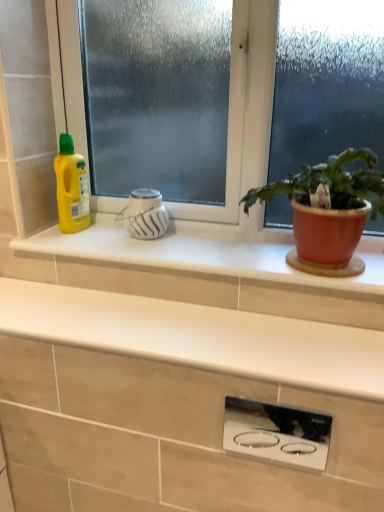
Image resolution: width=384 pixels, height=512 pixels. What do you see at coordinates (179, 400) in the screenshot? I see `white matte countertop at center` at bounding box center [179, 400].

Describe the element at coordinates (71, 187) in the screenshot. This screenshot has height=512, width=384. I see `yellow plastic bottle at left` at that location.

You are a GUI agent. You are given a task and a screenshot of the screen. Output one action in this format:
    pyautogui.click(x=<x>, y=<y>)
    Task: Click on the white glossy vase at center, which ranks as the 2th appliance in bottom-to-top order
    Image resolution: width=384 pixels, height=512 pixels.
    Given the screenshot: What is the action you would take?
    pyautogui.click(x=145, y=214)

Which object is thinner, frosted glass window at center or white matte countertop at center?

frosted glass window at center is thinner.

Is the surface of frosted glass window at center in direct contact with white matte countertop at center?

There is a gap between frosted glass window at center and white matte countertop at center.

Is frosted glass window at center looking in the opposite direction of white matte countertop at center?

No, frosted glass window at center is not facing the opposite direction of white matte countertop at center.

What's the angular difference between frosted glass window at center and white matte countertop at center's facing directions?

The angular difference between frosted glass window at center and white matte countertop at center is 0.252 degrees.

Is white glossy vase at center, which ranks as the 1th appliance in left-to-right order, looking in the opposite direction of polished stainless steel cooktop at center, positioned as the second appliance in left-to-right order?

No.

Between white glossy vase at center, positioned as the second appliance in front-to-back order, and polished stainless steel cooktop at center, acting as the 1th appliance starting from the front, which one appears on the right side from the viewer's perspective?

polished stainless steel cooktop at center, acting as the 1th appliance starting from the front.

Between white glossy vase at center, the first appliance positioned from the back, and polished stainless steel cooktop at center, the 2th appliance when ordered from top to bottom, which one has more height?

polished stainless steel cooktop at center, the 2th appliance when ordered from top to bottom, is taller.

Is polished stainless steel cooktop at center, arranged as the second appliance when viewed from the back, inside white glossy vase at center, the 2th appliance positioned from the right?

Definitely not — polished stainless steel cooktop at center, arranged as the second appliance when viewed from the back, is not inside white glossy vase at center, the 2th appliance positioned from the right.

The width and height of the screenshot is (384, 512). Find the location of `cleaning product above the polished stainless steel cooktop at center, which is the 1th appliance from bottom to top (from a real-world perspective)`. cleaning product above the polished stainless steel cooktop at center, which is the 1th appliance from bottom to top (from a real-world perspective) is located at coordinates [x=71, y=187].

From the image's perspective, which one is positioned lower, yellow plastic bottle at left or polished stainless steel cooktop at center, arranged as the second appliance when viewed from the back?

polished stainless steel cooktop at center, arranged as the second appliance when viewed from the back, from the image's perspective.

Does yellow plastic bottle at left have a larger size compared to polished stainless steel cooktop at center, which is the 1th appliance in right-to-left order?

Correct, yellow plastic bottle at left is larger in size than polished stainless steel cooktop at center, which is the 1th appliance in right-to-left order.

Which is more to the left, yellow plastic bottle at left or polished stainless steel cooktop at center, acting as the 1th appliance starting from the front?

From the viewer's perspective, yellow plastic bottle at left appears more on the left side.

Between white glossy window sill at center and frosted glass window at center, which one has more height?

Standing taller between the two is frosted glass window at center.

Are white glossy window sill at center and frosted glass window at center beside each other?

No, white glossy window sill at center is not in contact with frosted glass window at center.

Which is less distant, (231,256) or (284,59)?

Positioned in front is point (284,59).

Which is closer to the camera, (226, 191) or (77, 252)?

Point (226, 191) is positioned farther from the camera compared to point (77, 252).

Considering the sizes of frosted glass window at center and white glossy window sill at center in the image, is frosted glass window at center bigger or smaller than white glossy window sill at center?

Considering their sizes, frosted glass window at center takes up more space than white glossy window sill at center.

Who is shorter, frosted glass window at center or white glossy window sill at center?

white glossy window sill at center is shorter.

Considering the relative sizes of frosted glass window at center and yellow plastic bottle at left in the image provided, is frosted glass window at center thinner than yellow plastic bottle at left?

Yes.

Is frosted glass window at center not inside yellow plastic bottle at left?

frosted glass window at center is positioned outside yellow plastic bottle at left.

From a real-world perspective, is frosted glass window at center beneath yellow plastic bottle at left?

Incorrect, from a real-world perspective, frosted glass window at center is higher than yellow plastic bottle at left.

Considering the points (339, 56) and (80, 205), which point is in front, point (339, 56) or point (80, 205)?

The point (339, 56) is in front.

Are polished stainless steel cooktop at center, which is the 1th appliance from bottom to top, and matte terracotta pot at right making contact?

They are not placed beside each other.

Between polished stainless steel cooktop at center, acting as the 1th appliance starting from the front, and matte terracotta pot at right, which one has smaller width?

polished stainless steel cooktop at center, acting as the 1th appliance starting from the front.

Does polished stainless steel cooktop at center, acting as the 1th appliance starting from the front, have a larger size compared to matte terracotta pot at right?

No, polished stainless steel cooktop at center, acting as the 1th appliance starting from the front, is not bigger than matte terracotta pot at right.

The image size is (384, 512). I want to click on countertop lying in front of the frosted glass window at center, so click(x=179, y=400).

You are a GUI agent. You are given a task and a screenshot of the screen. Output one action in this format:
    pyautogui.click(x=<x>, y=<y>)
    Task: Click on the appliance below the white glossy vase at center, which ranks as the 2th appliance in bottom-to-top order (from the image's perspective)
    The width and height of the screenshot is (384, 512).
    Given the screenshot: What is the action you would take?
    pyautogui.click(x=276, y=433)

From the image, which object appears to be farther from white glossy vase at center, acting as the 1th appliance starting from the top, white matte countertop at center or yellow plastic bottle at left?

Among the two, white matte countertop at center is located further to white glossy vase at center, acting as the 1th appliance starting from the top.

When comparing their distances from yellow plastic bottle at left, does polished stainless steel cooktop at center, positioned as the second appliance in left-to-right order, or frosted glass window at center seem further?

polished stainless steel cooktop at center, positioned as the second appliance in left-to-right order.

Based on their spatial positions, is yellow plastic bottle at left or matte terracotta pot at right closer to white matte countertop at center?

matte terracotta pot at right lies closer to white matte countertop at center than the other object.

Which object lies further to the anchor point matte terracotta pot at right, white matte countertop at center or white glossy vase at center, which ranks as the 1th appliance in left-to-right order?

white glossy vase at center, which ranks as the 1th appliance in left-to-right order, is further to matte terracotta pot at right.

Which object lies nearer to the anchor point polished stainless steel cooktop at center, arranged as the second appliance when viewed from the back, white matte countertop at center or frosted glass window at center?

white matte countertop at center is closer to polished stainless steel cooktop at center, arranged as the second appliance when viewed from the back.

Considering their positions, is frosted glass window at center positioned closer to matte terracotta pot at right than polished stainless steel cooktop at center, which is the 1th appliance from bottom to top?

Based on the image, frosted glass window at center appears to be nearer to matte terracotta pot at right.

Estimate the real-world distances between objects in this image. Which object is further from polished stainless steel cooktop at center, acting as the 1th appliance starting from the front, yellow plastic bottle at left or white glossy vase at center, the 2th appliance positioned from the right?

Based on the image, yellow plastic bottle at left appears to be further to polished stainless steel cooktop at center, acting as the 1th appliance starting from the front.

Considering their positions, is white glossy window sill at center positioned further to yellow plastic bottle at left than matte terracotta pot at right?

matte terracotta pot at right is positioned further to the anchor yellow plastic bottle at left.

Image resolution: width=384 pixels, height=512 pixels. I want to click on window sill that lies between yellow plastic bottle at left and polished stainless steel cooktop at center, arranged as the second appliance when viewed from the back, from top to bottom, so click(204, 252).

The width and height of the screenshot is (384, 512). I want to click on appliance between yellow plastic bottle at left and polished stainless steel cooktop at center, arranged as the second appliance when viewed from the back, in the up-down direction, so click(145, 214).

The image size is (384, 512). What are the coordinates of `window sill that lies between matte terracotta pot at right and polished stainless steel cooktop at center, the 2th appliance when ordered from top to bottom, from top to bottom` in the screenshot? It's located at (204, 252).

The height and width of the screenshot is (512, 384). I want to click on countertop between white glossy vase at center, the first appliance positioned from the back, and polished stainless steel cooktop at center, acting as the 1th appliance starting from the front, in the vertical direction, so point(179,400).